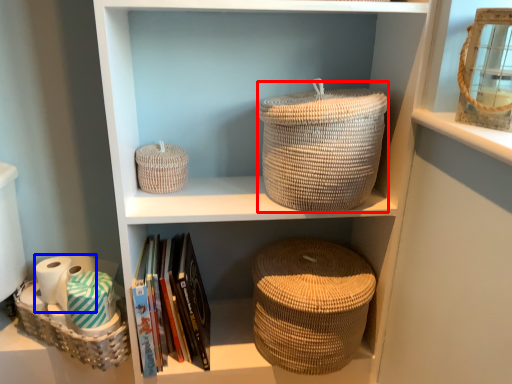
Question: Which point is closer to the camera, basket (highlighted by a red box) or toilet paper (highlighted by a blue box)?

Choices:
 (A) basket
 (B) toilet paper

Answer: (A)